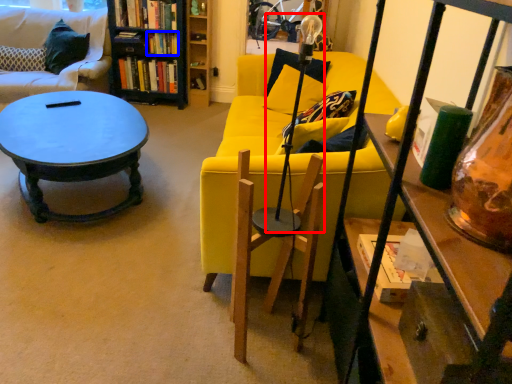
Question: Which of the following is the farthest to the observer, lamp (highlighted by a red box) or book (highlighted by a blue box)?

Choices:
 (A) lamp
 (B) book

Answer: (B)